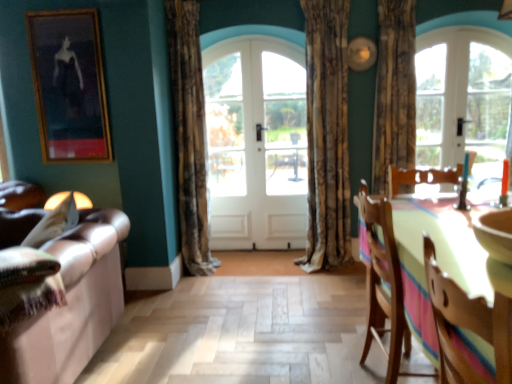
Question: Is white glossy door at center, the 2th screen door when ordered from right to left, spatially inside brown textured curtain at center, the first curtain in the left-to-right sequence, or outside of it?

Choices:
 (A) inside
 (B) outside

Answer: (B)

Question: In the image, is white glossy door at center, the 2th screen door when ordered from right to left, on the left side or the right side of brown textured curtain at center, acting as the third curtain starting from the right?

Choices:
 (A) left
 (B) right

Answer: (B)

Question: Which object is positioned farthest from the brown textured curtain at center, placed as the first curtain when sorted from right to left?

Choices:
 (A) textured beige curtain at center, the 2th curtain viewed from the left
 (B) brown textured curtain at center, the first curtain in the left-to-right sequence
 (C) white wooden door at center
 (D) clear glass door at upper right
 (E) leather couch at left

Answer: (E)

Question: Which object is the closest to the brown textured curtain at center, acting as the third curtain starting from the right?

Choices:
 (A) leather couch at left
 (B) white glossy door at center, the 2th screen door when ordered from right to left
 (C) white wood door at right
 (D) wooden chair at lower right, which is the second chair from back to front
 (E) textured beige curtain at center, the 2th curtain viewed from the left

Answer: (B)